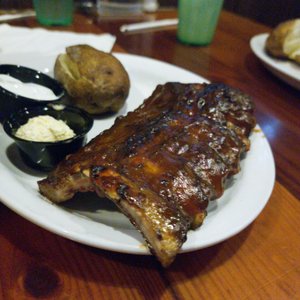
The image size is (300, 300). I want to click on green glass, so click(x=200, y=18), click(x=56, y=11).